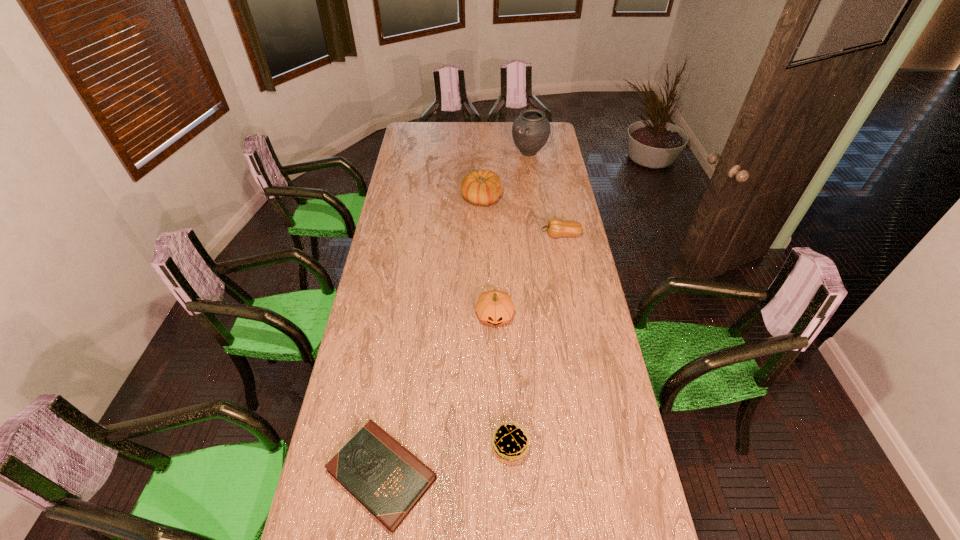
Find the location of a particular element. The image size is (960, 540). vacant area that lies between the second nearest gourd and the shortest object is located at coordinates (471, 355).

Where is `vacant space that is in between the tallest object and the third nearest object`? The height and width of the screenshot is (540, 960). vacant space that is in between the tallest object and the third nearest object is located at coordinates (512, 234).

Where is `the second closest object to the farthest gourd`? This screenshot has width=960, height=540. the second closest object to the farthest gourd is located at coordinates (531, 130).

Where is `object that is the third closest to the patty`? The width and height of the screenshot is (960, 540). object that is the third closest to the patty is located at coordinates (556, 227).

You are a GUI agent. You are given a task and a screenshot of the screen. Output one action in this format:
    pyautogui.click(x=<x>, y=<y>)
    Task: Click on the gourd object that ranks as the closest to the nearest gourd
    
    Given the screenshot: What is the action you would take?
    pyautogui.click(x=556, y=227)

In order to click on gourd that is the second closest to the urn in this screenshot , I will do `click(556, 227)`.

Identify the location of blank area in the image that satisfies the following two spatial constraints: 1. on the side of the patty with the carved face; 2. on the left side of the third nearest object. (498, 447).

Where is `free region that satisfies the following two spatial constraints: 1. on the stem side of the shortest gourd; 2. on the front side of the shortest object`? free region that satisfies the following two spatial constraints: 1. on the stem side of the shortest gourd; 2. on the front side of the shortest object is located at coordinates (608, 474).